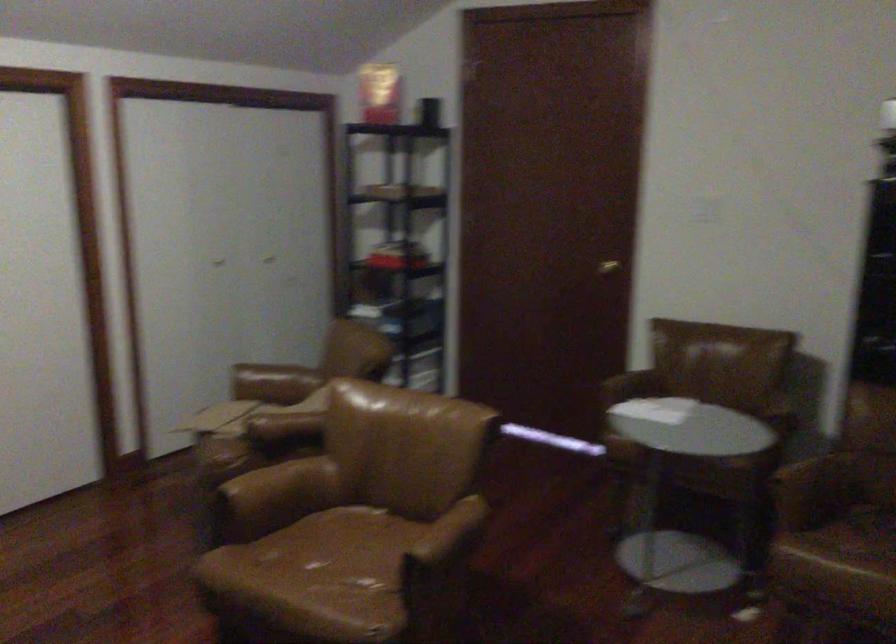
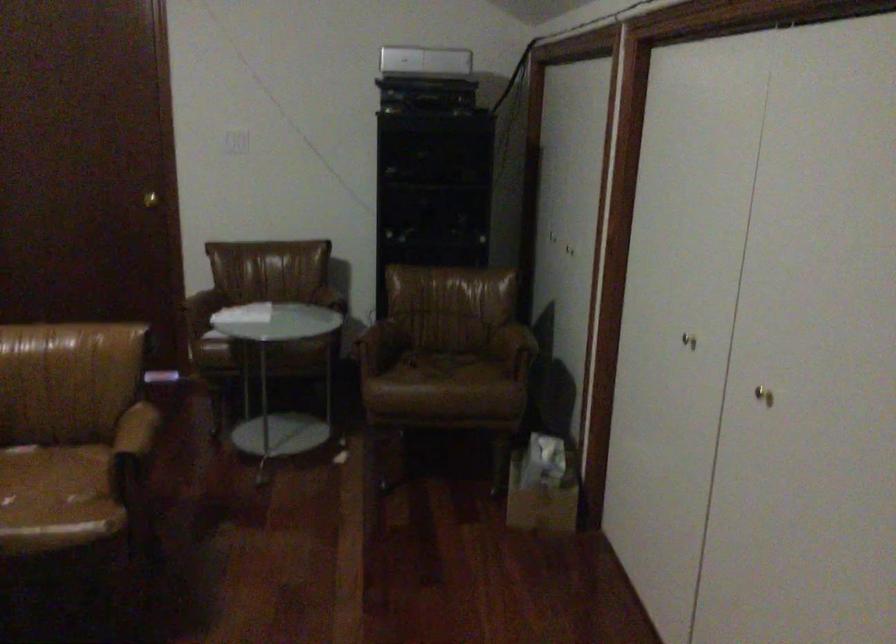
Question: The camera is either moving clockwise (left) or counter-clockwise (right) around the object. The first image is from the beginning of the video and the second image is from the end. Is the camera moving left or right when shooting the video?

Choices:
 (A) Left
 (B) Right

Answer: (A)